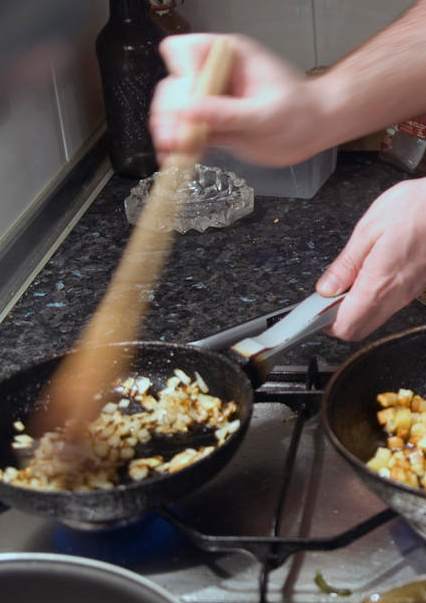
Find the location of a particular element. dark frying pan is located at coordinates (173, 485), (340, 402).